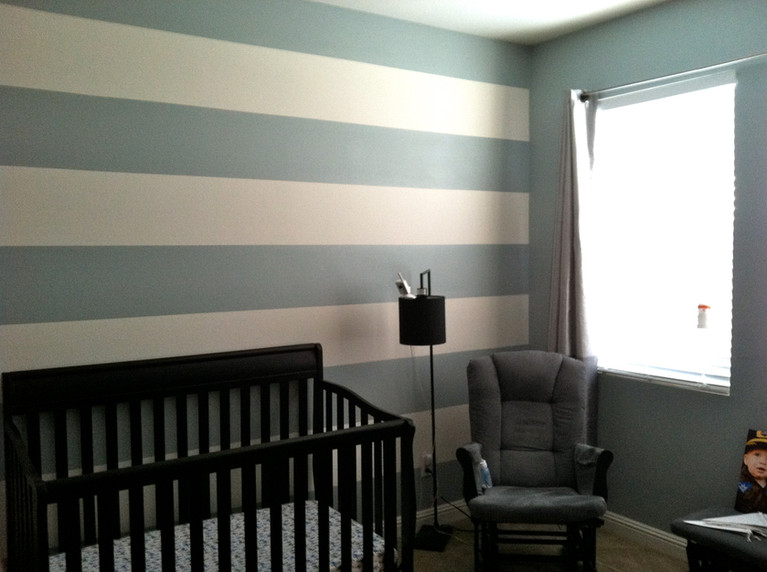
Where is `gray rocking chair`? The height and width of the screenshot is (572, 767). gray rocking chair is located at coordinates (545, 506).